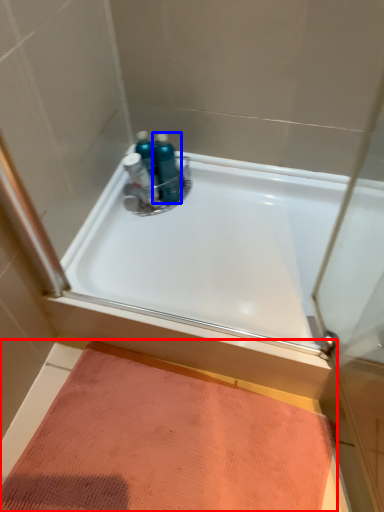
Question: Among these objects, which one is nearest to the camera, doormat (highlighted by a red box) or toiletry (highlighted by a blue box)?

Choices:
 (A) doormat
 (B) toiletry

Answer: (A)